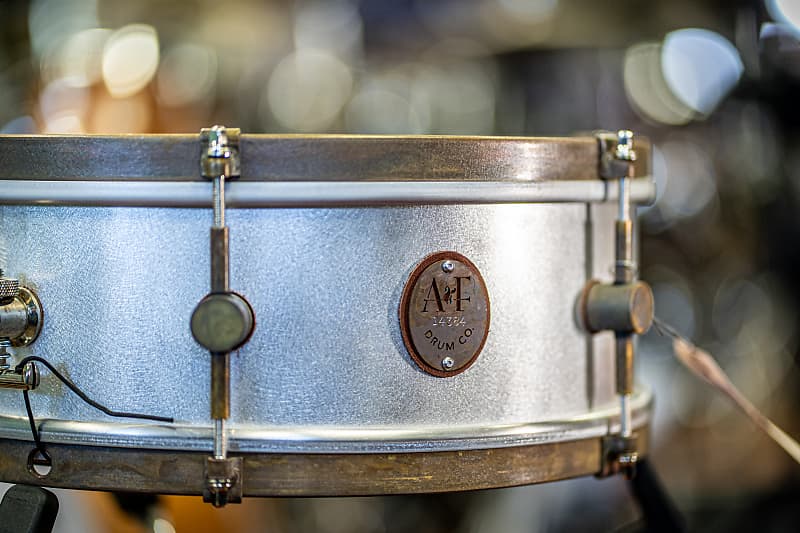
This screenshot has width=800, height=533. What are the coordinates of `light` in the screenshot? It's located at (125, 49).